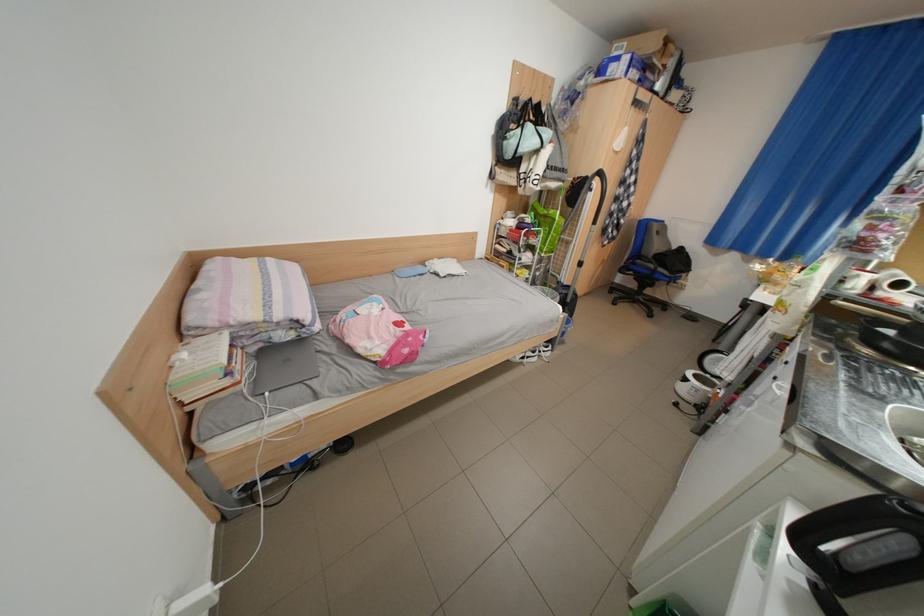
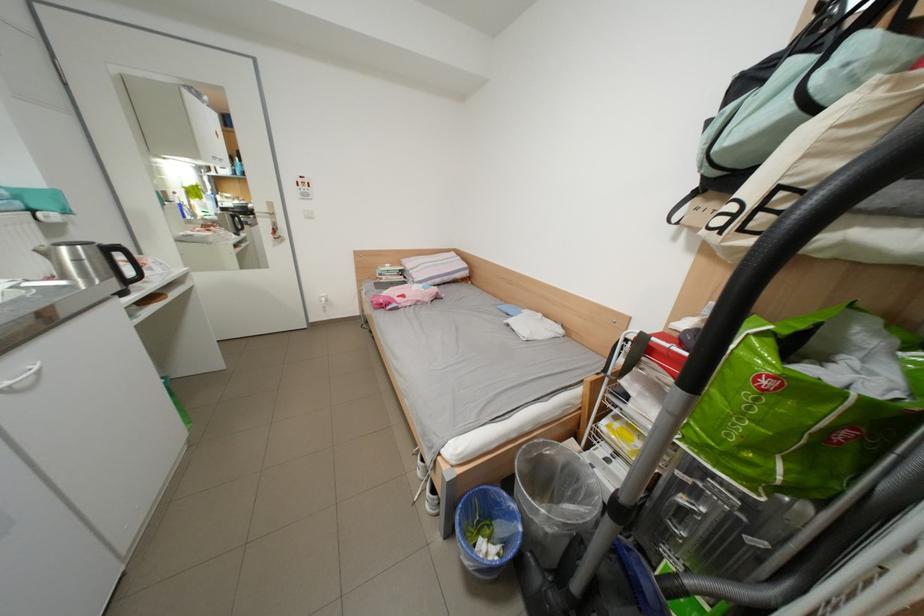
In the second image, find the point that corresponds to point 789,392 in the first image.

(46, 369)